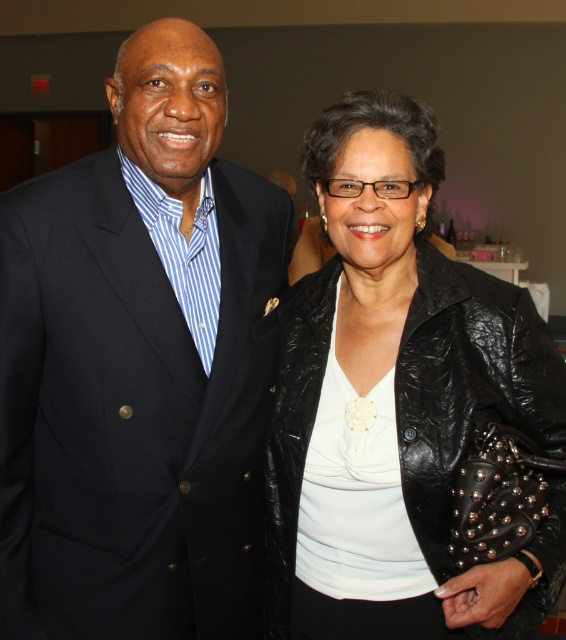
Question: Is matte black suit at left bigger than black leather jacket at right?

Choices:
 (A) no
 (B) yes

Answer: (B)

Question: Is matte black suit at left positioned behind black leather jacket at right?

Choices:
 (A) yes
 (B) no

Answer: (A)

Question: Which point is closer to the camera taking this photo?

Choices:
 (A) pyautogui.click(x=161, y=92)
 (B) pyautogui.click(x=482, y=445)

Answer: (B)

Question: Does matte black suit at left have a smaller size compared to black leather jacket at right?

Choices:
 (A) yes
 (B) no

Answer: (B)

Question: Which of the following is the farthest from the observer?

Choices:
 (A) (45, 406)
 (B) (348, 99)

Answer: (A)